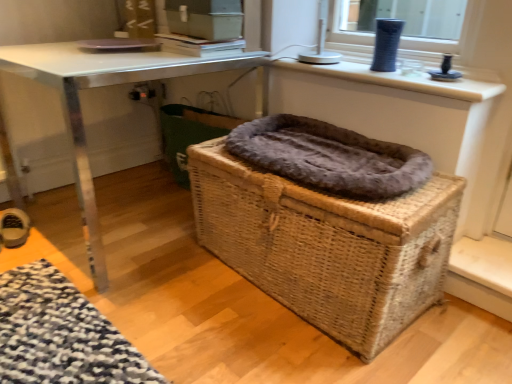
Find the location of `metallic silver table at center`. metallic silver table at center is located at coordinates (103, 86).

Find the location of a particular element. The height and width of the screenshot is (384, 512). fuzzy brown laundry basket at center is located at coordinates (189, 134).

This screenshot has height=384, width=512. Identify the location of fuzzy gray blanket at center. (329, 157).

Identify the location of woven brown basket at center. (327, 245).

Where is `leather shoe at lower left`? The height and width of the screenshot is (384, 512). leather shoe at lower left is located at coordinates (14, 227).

Consider the image. Is fuzzy brown laundry basket at center touching fuzzy gray blanket at center?

No, fuzzy brown laundry basket at center is not touching fuzzy gray blanket at center.

Is fuzzy brown laundry basket at center bigger or smaller than fuzzy gray blanket at center?

In the image, fuzzy brown laundry basket at center appears to be larger than fuzzy gray blanket at center.

From a real-world perspective, which object stands above the other?

From a 3D spatial view, fuzzy gray blanket at center is above.

From the image's perspective, which is below, fuzzy brown laundry basket at center or fuzzy gray blanket at center?

fuzzy gray blanket at center, from the image's perspective.

Could you tell me if metallic silver table at center is facing fuzzy brown laundry basket at center?

No, metallic silver table at center does not turn towards fuzzy brown laundry basket at center.

From the image's perspective, is metallic silver table at center located above or below fuzzy brown laundry basket at center?

Clearly, from the image's perspective, metallic silver table at center is above fuzzy brown laundry basket at center.

Which object is positioned more to the left, metallic silver table at center or fuzzy brown laundry basket at center?

metallic silver table at center is more to the left.

Which object is thinner, fuzzy gray blanket at center or leather shoe at lower left?

Thinner between the two is leather shoe at lower left.

Is fuzzy gray blanket at center directly adjacent to leather shoe at lower left?

No, fuzzy gray blanket at center is not in contact with leather shoe at lower left.

Between fuzzy gray blanket at center and leather shoe at lower left, which one appears on the right side from the viewer's perspective?

Positioned to the right is fuzzy gray blanket at center.

From a real-world perspective, is fuzzy gray blanket at center positioned over leather shoe at lower left based on gravity?

Correct, in the physical world, fuzzy gray blanket at center is higher than leather shoe at lower left.

Where is `counter top lying above the fuzzy brown laundry basket at center (from the image's perspective)`? This screenshot has height=384, width=512. counter top lying above the fuzzy brown laundry basket at center (from the image's perspective) is located at coordinates (410, 79).

How different are the orientations of matte blue vase at upper right and fuzzy brown laundry basket at center in degrees?

The angular difference between matte blue vase at upper right and fuzzy brown laundry basket at center is 1.03 degrees.

Is matte blue vase at upper right turned away from fuzzy brown laundry basket at center?

No, fuzzy brown laundry basket at center is not at the back of matte blue vase at upper right.

From a real-world perspective, relative to fuzzy brown laundry basket at center, is matte blue vase at upper right vertically above or below?

matte blue vase at upper right is situated higher than fuzzy brown laundry basket at center in the real world.

Is fuzzy gray blanket at center wider or thinner than fuzzy brown laundry basket at center?

Clearly, fuzzy gray blanket at center has more width compared to fuzzy brown laundry basket at center.

Between fuzzy gray blanket at center and fuzzy brown laundry basket at center, which one appears on the left side from the viewer's perspective?

From the viewer's perspective, fuzzy brown laundry basket at center appears more on the left side.

What's the angular difference between fuzzy gray blanket at center and fuzzy brown laundry basket at center's facing directions?

The facing directions of fuzzy gray blanket at center and fuzzy brown laundry basket at center are 0.000565 degrees apart.

Based on the photo, from the image's perspective, relative to matte blue vase at upper right, is leather shoe at lower left above or below?

leather shoe at lower left is situated lower than matte blue vase at upper right in the image.

Where is `counter top located above the leather shoe at lower left (from the image's perspective)`? This screenshot has width=512, height=384. counter top located above the leather shoe at lower left (from the image's perspective) is located at coordinates (410, 79).

Is leather shoe at lower left to the right of matte blue vase at upper right from the viewer's perspective?

No.

Does leather shoe at lower left have a lesser width compared to matte blue vase at upper right?

In fact, leather shoe at lower left might be wider than matte blue vase at upper right.

From the image's perspective, would you say metallic silver table at center is positioned over woven brown basket at center?

Yes.

Does point (85, 145) come in front of point (429, 261)?

No.

Visually, is metallic silver table at center positioned to the left or to the right of woven brown basket at center?

metallic silver table at center is to the left of woven brown basket at center.

Considering the sizes of metallic silver table at center and woven brown basket at center in the image, is metallic silver table at center bigger or smaller than woven brown basket at center?

metallic silver table at center is bigger than woven brown basket at center.

You are a GUI agent. You are given a task and a screenshot of the screen. Output one action in this format:
    pyautogui.click(x=<x>, y=<y>)
    Task: Click on the blanket on the right side of fuzzy brown laundry basket at center
    The height and width of the screenshot is (384, 512).
    Given the screenshot: What is the action you would take?
    coord(329,157)

Locate an element on the screen. Image resolution: width=512 pixels, height=384 pixels. laundry basket below the metallic silver table at center (from the image's perspective) is located at coordinates (189, 134).

When comparing their distances from leather shoe at lower left, does fuzzy gray blanket at center or fuzzy brown laundry basket at center seem further?

The object further to leather shoe at lower left is fuzzy gray blanket at center.

Which object lies further to the anchor point fuzzy gray blanket at center, leather shoe at lower left or woven brown basket at center?

leather shoe at lower left is further to fuzzy gray blanket at center.

Which object lies further to the anchor point fuzzy gray blanket at center, metallic silver table at center or fuzzy brown laundry basket at center?

Among the two, metallic silver table at center is located further to fuzzy gray blanket at center.

Considering their positions, is metallic silver table at center positioned closer to matte blue vase at upper right than woven brown basket at center?

woven brown basket at center is positioned closer to the anchor matte blue vase at upper right.

Considering their positions, is metallic silver table at center positioned closer to leather shoe at lower left than fuzzy brown laundry basket at center?

Among the two, metallic silver table at center is located nearer to leather shoe at lower left.

Estimate the real-world distances between objects in this image. Which object is closer to matte blue vase at upper right, metallic silver table at center or fuzzy gray blanket at center?

The object closer to matte blue vase at upper right is fuzzy gray blanket at center.

Considering their positions, is fuzzy brown laundry basket at center positioned closer to leather shoe at lower left than woven brown basket at center?

fuzzy brown laundry basket at center lies closer to leather shoe at lower left than the other object.

Which object lies nearer to the anchor point leather shoe at lower left, fuzzy gray blanket at center or woven brown basket at center?

Among the two, woven brown basket at center is located nearer to leather shoe at lower left.

Where is `basket between metallic silver table at center and fuzzy gray blanket at center in the horizontal direction`? This screenshot has width=512, height=384. basket between metallic silver table at center and fuzzy gray blanket at center in the horizontal direction is located at coordinates (327, 245).

You are a GUI agent. You are given a task and a screenshot of the screen. Output one action in this format:
    pyautogui.click(x=<x>, y=<y>)
    Task: Click on the basket between leather shoe at lower left and matte blue vase at upper right
    
    Given the screenshot: What is the action you would take?
    tap(327, 245)

Locate an element on the screen. Image resolution: width=512 pixels, height=384 pixels. blanket between leather shoe at lower left and matte blue vase at upper right in the horizontal direction is located at coordinates pos(329,157).

Find the location of a particular element. The image size is (512, 384). blanket between woven brown basket at center and fuzzy brown laundry basket at center from front to back is located at coordinates (329, 157).